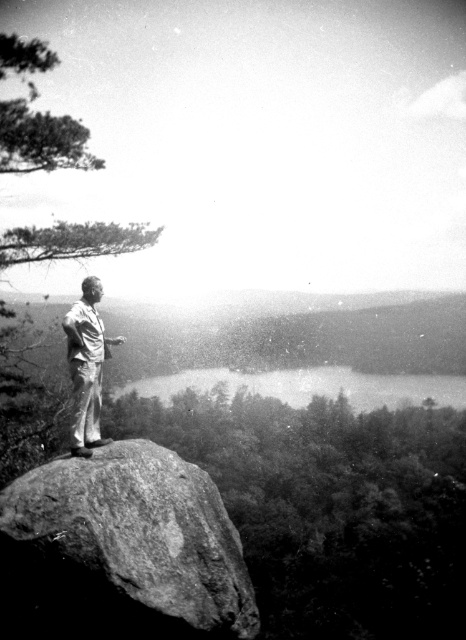
Question: Among these points, which one is farthest from the camera?

Choices:
 (A) (93, 513)
 (B) (89, 372)
 (C) (361, 372)

Answer: (C)

Question: Which point is farther to the camera?

Choices:
 (A) (118, 342)
 (B) (6, 516)
 (C) (369, 387)

Answer: (C)

Question: Does smooth granite boulder at center appear over smooth water at center?

Choices:
 (A) no
 (B) yes

Answer: (B)

Question: Does smooth water at center come behind light beige cotton pants at center?

Choices:
 (A) yes
 (B) no

Answer: (A)

Question: Is smooth water at center below light beige cotton pants at center?

Choices:
 (A) no
 (B) yes

Answer: (B)

Question: Among these objects, which one is nearest to the camera?

Choices:
 (A) smooth granite boulder at center
 (B) smooth water at center
 (C) light beige cotton pants at center

Answer: (A)